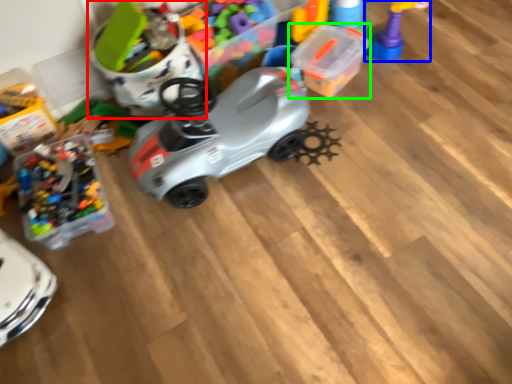
Question: Estimate the real-world distances between objects in this image. Which object is farther from toy (highlighted by a red box), toy (highlighted by a blue box) or toy (highlighted by a green box)?

Choices:
 (A) toy
 (B) toy

Answer: (A)